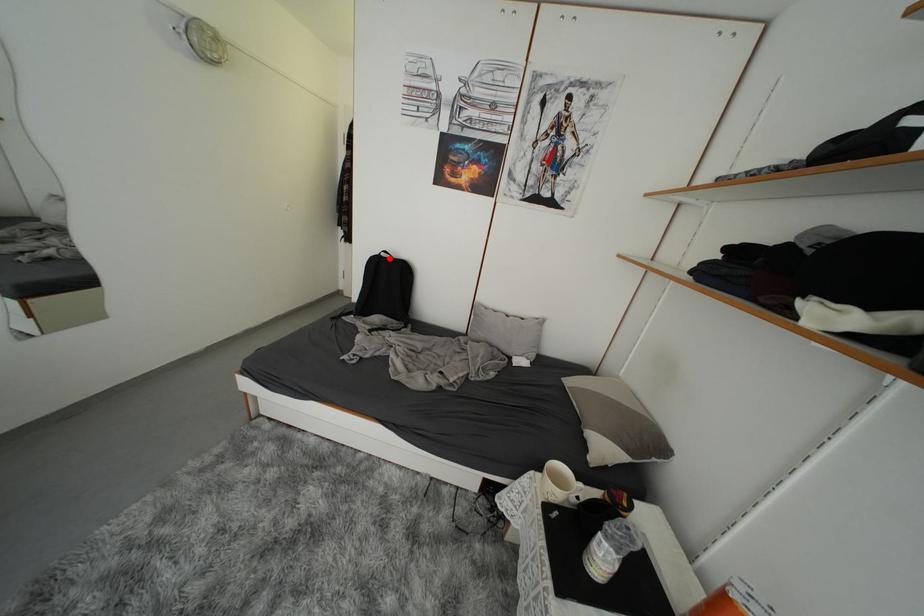
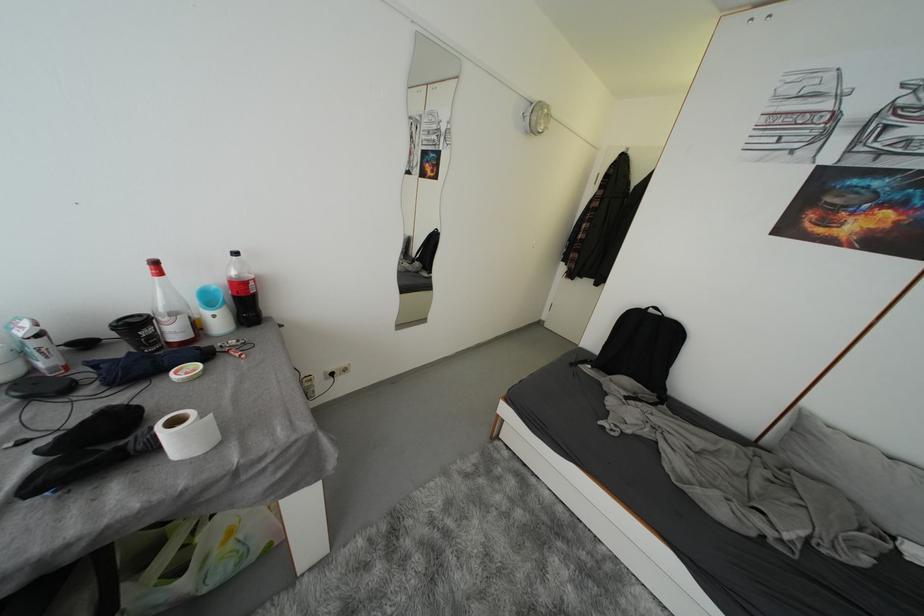
In the second image, find the point that corresponds to the highlighted location in the first image.

(658, 314)